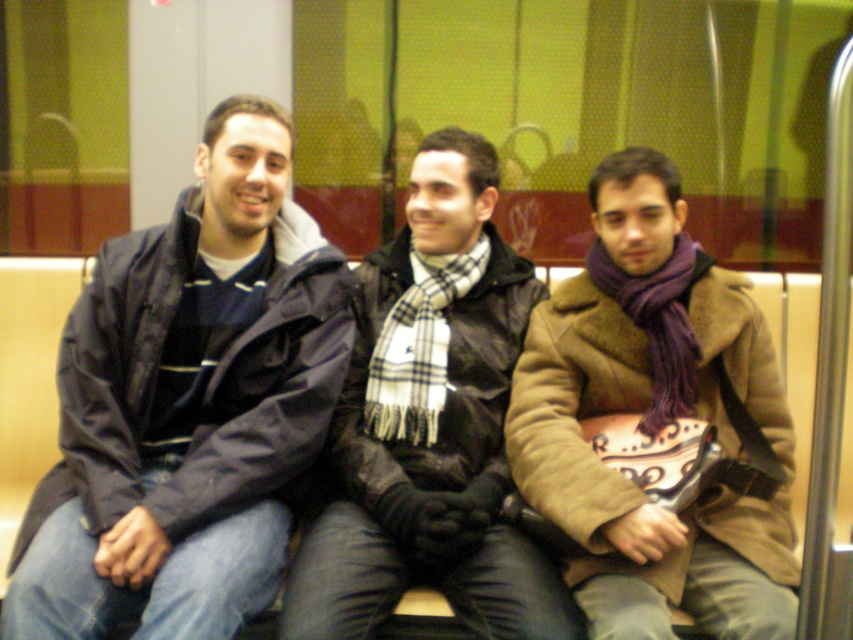
How far apart are purple wool scarf at center and plaid scarf at center?

purple wool scarf at center and plaid scarf at center are 23.91 centimeters apart.

Identify the location of purple wool scarf at center. (654, 420).

You are a GUI agent. You are given a task and a screenshot of the screen. Output one action in this format:
    pyautogui.click(x=<x>, y=<y>)
    Task: Click on the purple wool scarf at center
    Image resolution: width=853 pixels, height=640 pixels.
    Given the screenshot: What is the action you would take?
    pyautogui.click(x=654, y=420)

Measure the distance between matte black jacket at left and purple wool scarf at center.

The distance of matte black jacket at left from purple wool scarf at center is 24.36 inches.

This screenshot has height=640, width=853. Describe the element at coordinates (189, 404) in the screenshot. I see `matte black jacket at left` at that location.

The height and width of the screenshot is (640, 853). I want to click on matte black jacket at left, so click(x=189, y=404).

At what (x,y) coordinates should I click in order to perform the action: click on matte black jacket at left. Please return your answer as a coordinate pair (x, y). The width and height of the screenshot is (853, 640). Looking at the image, I should click on (189, 404).

Which is below, matte black jacket at left or plaid scarf at center?

plaid scarf at center is below.

Where is `matte black jacket at left`? This screenshot has height=640, width=853. matte black jacket at left is located at coordinates point(189,404).

Does point (57, 493) lie behind point (556, 614)?

Yes, it is behind point (556, 614).

Image resolution: width=853 pixels, height=640 pixels. In order to click on matte black jacket at left in this screenshot , I will do `click(189, 404)`.